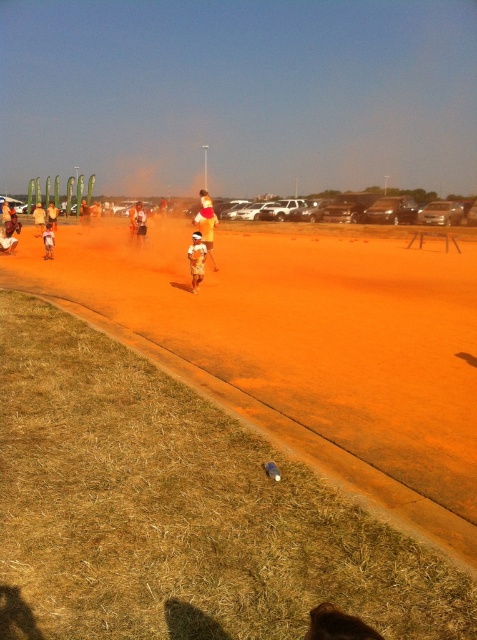
Question: Can you confirm if orange fabric shorts at center is positioned to the left of light brown wooden bat at center?

Choices:
 (A) yes
 (B) no

Answer: (B)

Question: Among these points, which one is nearest to the camera?

Choices:
 (A) 135,236
 (B) 40,216

Answer: (A)

Question: Estimate the real-world distances between objects in this image. Which object is farther from the yellow fabric shirt at center?

Choices:
 (A) orange cotton shirt at center
 (B) light brown wooden bat at center

Answer: (B)

Question: Considering the relative positions of orange fabric shorts at center and light brown cotton shorts at center in the image provided, where is orange fabric shorts at center located with respect to light brown cotton shorts at center?

Choices:
 (A) above
 (B) below

Answer: (B)

Question: Which point is closer to the camera?

Choices:
 (A) (35, 205)
 (B) (45, 246)

Answer: (B)

Question: Is yellow fabric shirt at center positioned at the back of orange cotton shirt at center?

Choices:
 (A) yes
 (B) no

Answer: (B)